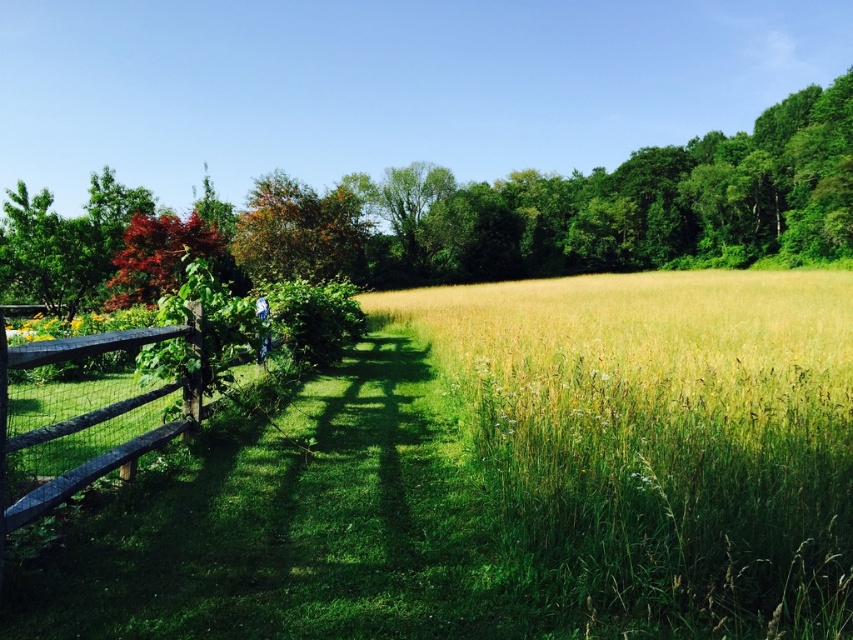
Can you confirm if brown wooden fence at left is smaller than brown leafy tree at center?

Yes.

Is point (45, 488) positioned after point (258, 237)?

That is False.

Identify the location of brown wooden fence at left. The width and height of the screenshot is (853, 640). (105, 449).

Can you confirm if green leafy tree at upper left is positioned below brown wooden fence at left?

No.

Measure the distance between point [9,262] and camera.

70.23 feet

Find the location of a particular element. The image size is (853, 640). green leafy tree at upper left is located at coordinates (566, 211).

Does green leafy tree at upper left come in front of shiny red maple leaf at upper left?

No, it is behind shiny red maple leaf at upper left.

Is green leafy tree at upper left below shiny red maple leaf at upper left?

No.

Locate an element on the screen. The width and height of the screenshot is (853, 640). green leafy tree at upper left is located at coordinates (566, 211).